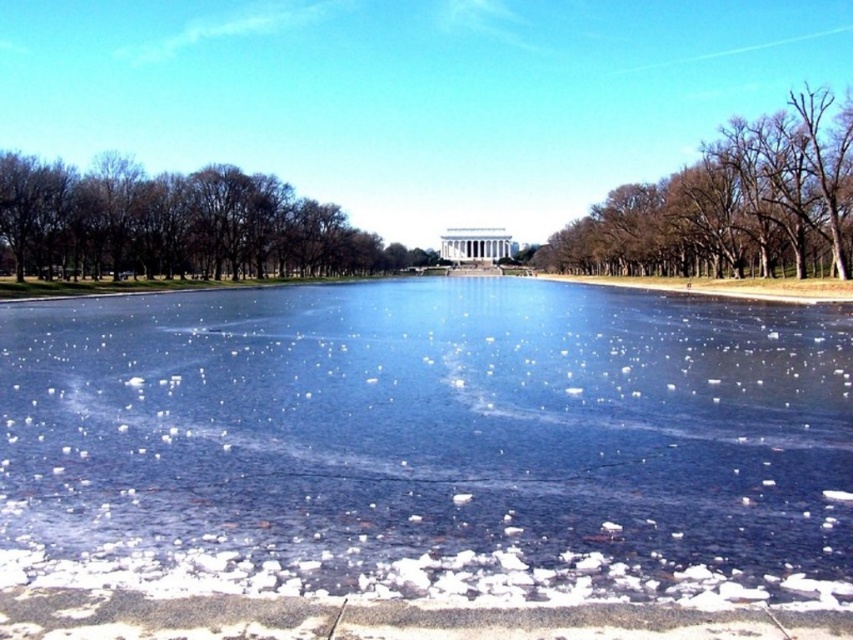
Who is more forward, (827, 496) or (718, 173)?

Point (827, 496) is in front.

This screenshot has width=853, height=640. Identify the location of transparent ice at center. (430, 442).

Locate an element on the screen. The width and height of the screenshot is (853, 640). transparent ice at center is located at coordinates (430, 442).

Which is more to the left, transparent ice at center or brown leafless trees at left?

brown leafless trees at left

What do you see at coordinates (430, 442) in the screenshot?
I see `transparent ice at center` at bounding box center [430, 442].

Locate an element on the screen. This screenshot has height=640, width=853. transparent ice at center is located at coordinates (430, 442).

Is brown leafless trees at left taller than bare brown tree at upper right?

Yes.

Looking at this image, is brown leafless trees at left above bare brown tree at upper right?

Indeed, brown leafless trees at left is positioned over bare brown tree at upper right.

Is point (59, 196) farther from viewer compared to point (824, 166)?

Yes, point (59, 196) is behind point (824, 166).

Where is `brown leafless trees at left`? Image resolution: width=853 pixels, height=640 pixels. brown leafless trees at left is located at coordinates (177, 225).